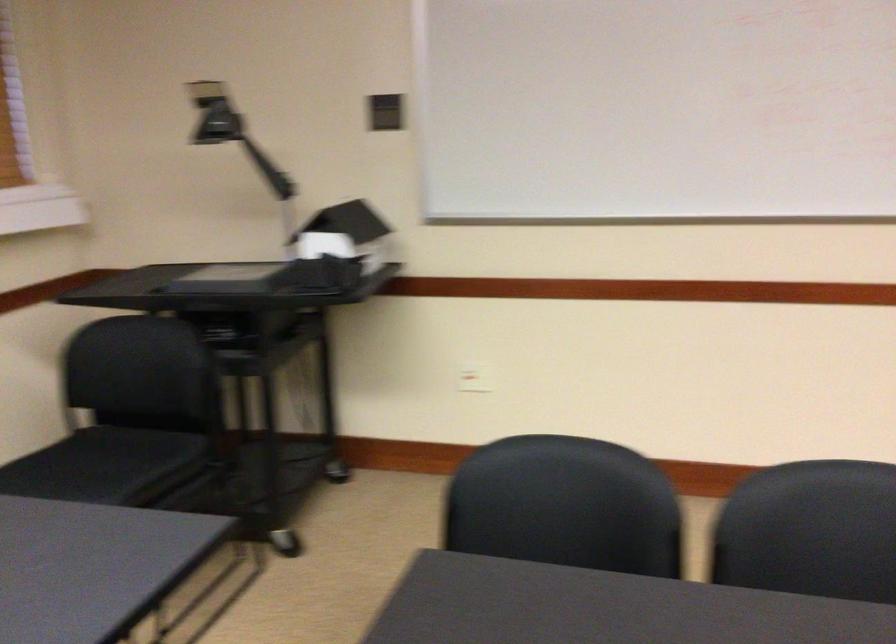
Find where to sit the chair sitting surface. Please return your answer as a coordinate pair (x, y).

(561, 494)